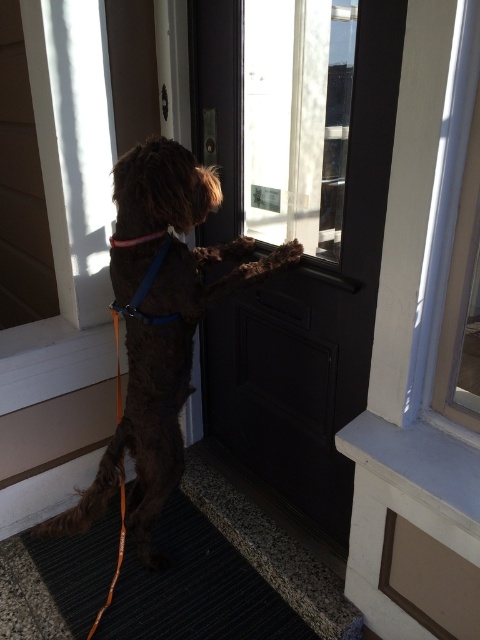
Can you confirm if black wooden door at center is positioned above blue fabric neckband at upper center?

No.

Is black wooden door at center bigger than blue fabric neckband at upper center?

Correct, black wooden door at center is larger in size than blue fabric neckband at upper center.

Which is behind, point (324, 58) or point (109, 241)?

Positioned behind is point (109, 241).

Image resolution: width=480 pixels, height=640 pixels. In order to click on black wooden door at center in this screenshot , I will do `click(296, 230)`.

Who is higher up, black wooden door at center or transparent glass door at upper center?

transparent glass door at upper center is higher up.

Is point (207, 372) closer to viewer compared to point (252, 161)?

That is False.

Who is more forward, (x=307, y=182) or (x=280, y=52)?

Point (x=280, y=52)

Image resolution: width=480 pixels, height=640 pixels. Find the location of `black wooden door at center`. black wooden door at center is located at coordinates (296, 230).

Find the location of a particular element. dark gray textured mat at lower center is located at coordinates (196, 589).

Can you confirm if dark gray textured mat at lower center is positioned below blue fabric neckband at upper center?

Yes.

Who is more forward, (132,625) or (146,234)?

Positioned in front is point (146,234).

Where is `dark gray textured mat at lower center`? The height and width of the screenshot is (640, 480). dark gray textured mat at lower center is located at coordinates (196, 589).